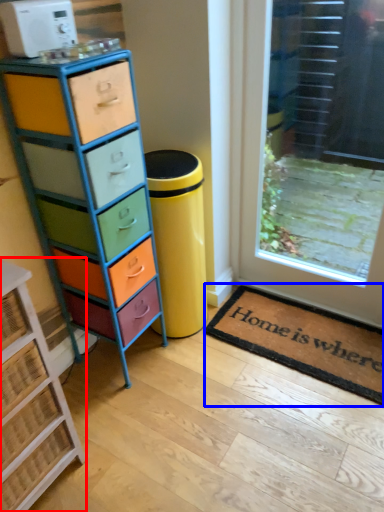
Question: Which object appears closest to the camera in this image, chest of drawers (highlighted by a red box) or doormat (highlighted by a blue box)?

Choices:
 (A) chest of drawers
 (B) doormat

Answer: (A)